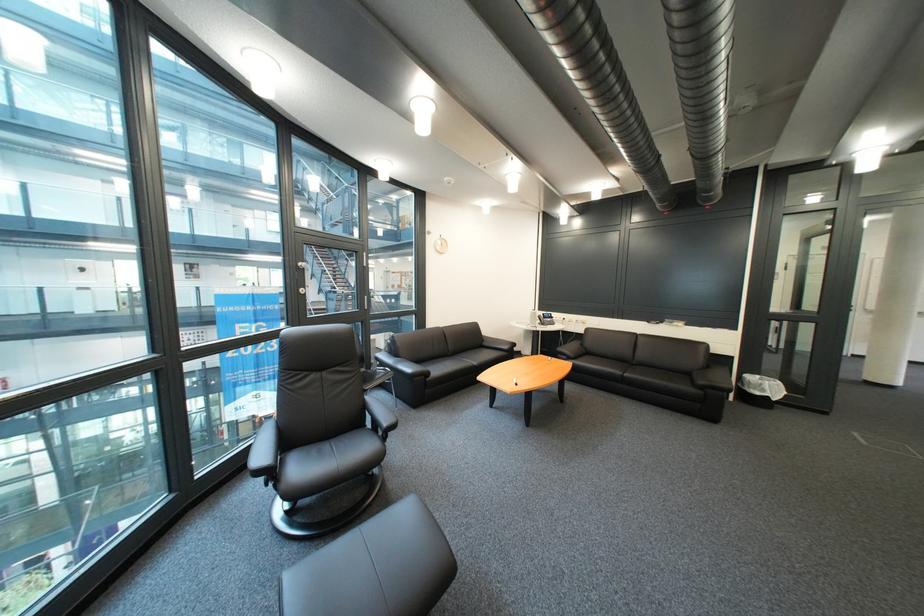
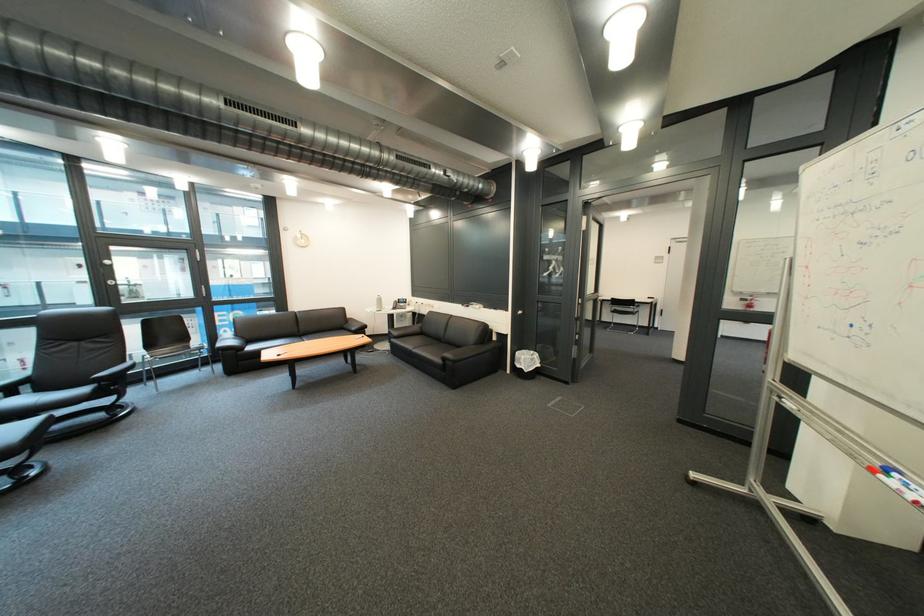
In the second image, find the point that corresponds to (x=715, y=390) in the first image.

(457, 361)